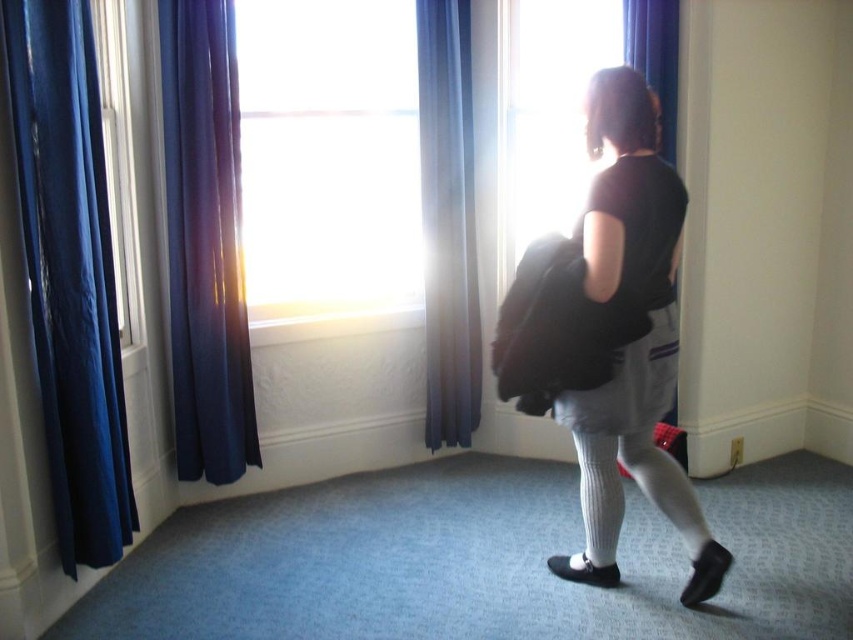
Question: Which object appears farthest from the camera in this image?

Choices:
 (A) blue fabric curtain at center
 (B) dark blue fabric curtain at left
 (C) matte black coat at center

Answer: (A)

Question: Which object is positioned farthest from the white knit tights at lower center?

Choices:
 (A) transparent glass window at upper center
 (B) dark blue fabric curtain at left
 (C) blue fabric curtain at center

Answer: (B)

Question: Can you confirm if matte black coat at center is bigger than blue fabric curtain at center?

Choices:
 (A) yes
 (B) no

Answer: (A)

Question: Is blue fabric curtain at center smaller than white knit tights at lower center?

Choices:
 (A) yes
 (B) no

Answer: (A)

Question: Can you confirm if transparent glass window at upper center is positioned to the left of dark blue fabric curtain at left?

Choices:
 (A) yes
 (B) no

Answer: (B)

Question: Considering the real-world distances, which object is farthest from the blue glossy curtain at left?

Choices:
 (A) blue fabric curtain at center
 (B) matte black coat at center

Answer: (B)